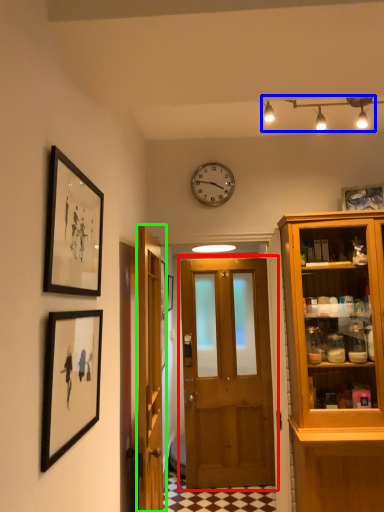
Question: Which is nearer to the door (highlighted by a red box)? light fixture (highlighted by a blue box) or door (highlighted by a green box).

Choices:
 (A) light fixture
 (B) door

Answer: (B)